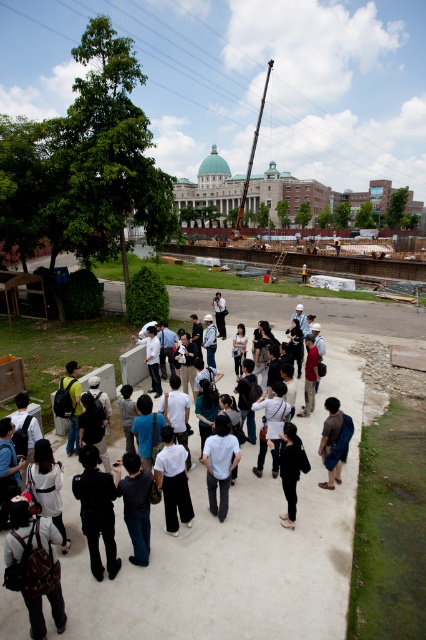
Question: Among these points, which one is nearest to the camera?

Choices:
 (A) (29, 544)
 (B) (268, 611)

Answer: (A)

Question: Which point appears farthest from the camera in this image?

Choices:
 (A) (327, 461)
 (B) (34, 611)
 (C) (72, 468)
 (D) (213, 488)

Answer: (C)

Question: Among these points, which one is farthest from the camera?

Choices:
 (A) (198, 490)
 (B) (328, 472)
 (C) (54, 532)
 (D) (213, 435)

Answer: (B)

Question: Is white casual clothing at center to the left of brown fabric shirt at center from the viewer's perspective?

Choices:
 (A) no
 (B) yes

Answer: (B)

Question: Is matte brown backpack at lower left above brown fabric shirt at center?

Choices:
 (A) no
 (B) yes

Answer: (A)

Question: Observing the image, what is the correct spatial positioning of white casual clothing at center in reference to matte brown backpack at lower left?

Choices:
 (A) above
 (B) below

Answer: (A)